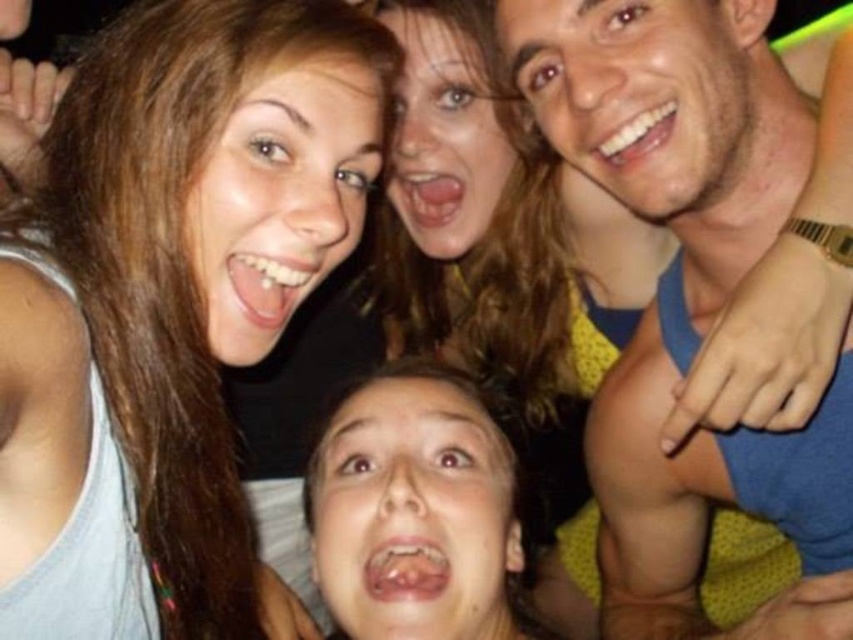
Which of these two, matte gray tank top at lower left or smooth skin man at upper right, stands taller?

Standing taller between the two is smooth skin man at upper right.

Which is more to the left, matte gray tank top at lower left or smooth skin man at upper right?

Result: matte gray tank top at lower left is more to the left.

Does point (206, 243) come farther from viewer compared to point (842, 609)?

Yes.

Where is `matte gray tank top at lower left`? Image resolution: width=853 pixels, height=640 pixels. matte gray tank top at lower left is located at coordinates (167, 301).

In the scene shown: Is matte gray tank top at lower left above matte black top at upper center?

Indeed, matte gray tank top at lower left is positioned over matte black top at upper center.

Does matte gray tank top at lower left have a greater width compared to matte black top at upper center?

No, matte gray tank top at lower left is not wider than matte black top at upper center.

Who is more forward, (200, 116) or (582, 204)?

Point (200, 116)

Where is `matte gray tank top at lower left`? Image resolution: width=853 pixels, height=640 pixels. matte gray tank top at lower left is located at coordinates (167, 301).

Who is positioned more to the left, smooth skin man at upper right or matte black top at upper center?

matte black top at upper center

Can you confirm if smooth skin man at upper right is wider than matte black top at upper center?

Incorrect, smooth skin man at upper right's width does not surpass matte black top at upper center's.

Is point (752, 28) in front of point (497, 148)?

Yes, it is in front of point (497, 148).

I want to click on smooth skin man at upper right, so click(666, 168).